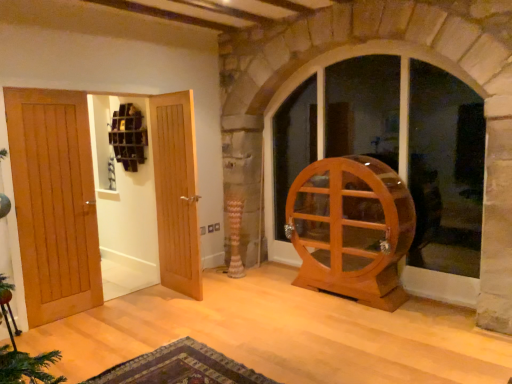
At what (x,y) coordinates should I click in order to perform the action: click on vacant space underneath light brown wood door at left, positioned as the 2th door in left-to-right order (from a real-world perspective). Please return your answer as a coordinate pair (x, y). Looking at the image, I should click on (123, 301).